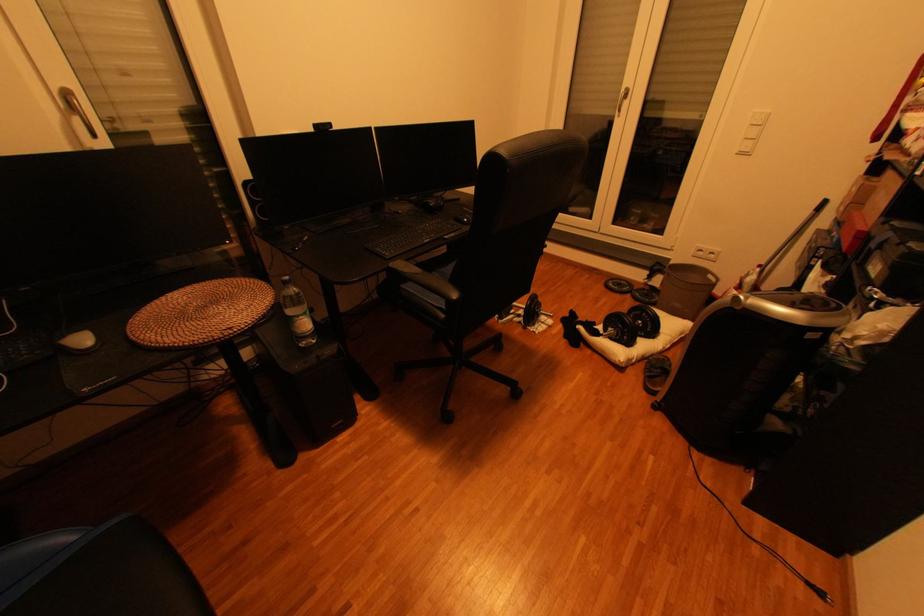
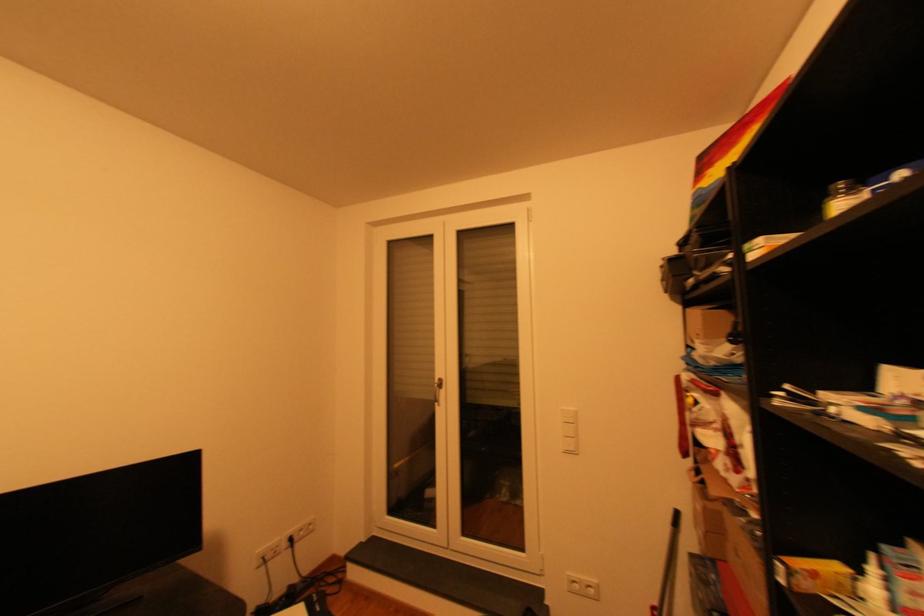
The point at [749,155] is marked in the first image. Where is the corresponding point in the second image?

(576, 453)